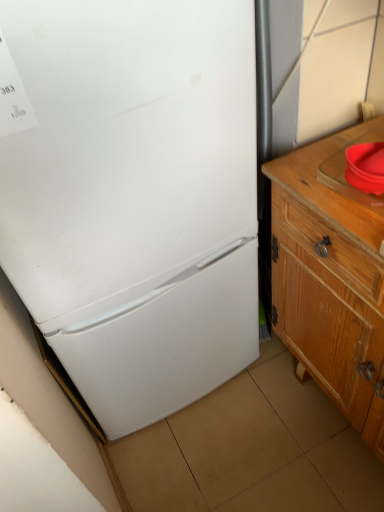
Locate an element on the screen. wooden cabinet at right is located at coordinates (331, 275).

In order to face wooden cabinet at right, should I rotate leftwards or rightwards?

It's best to rotate right around 24.276 degrees.

Locate an element on the screen. red plastic sink at right is located at coordinates (345, 170).

Is wooden cabinet at right aimed at red plastic sink at right?

No, wooden cabinet at right is not facing towards red plastic sink at right.

Is wooden cabinet at right beside red plastic sink at right?

No, wooden cabinet at right is not touching red plastic sink at right.

From the image's perspective, which is below, wooden cabinet at right or red plastic sink at right?

wooden cabinet at right appears lower in the image.

From the image's perspective, is white matte refrigerator at left above red plastic sink at right?

Actually, white matte refrigerator at left appears below red plastic sink at right in the image.

This screenshot has height=512, width=384. In order to click on sink on the right of white matte refrigerator at left in this screenshot , I will do `click(345, 170)`.

Does point (168, 317) come farther from viewer compared to point (383, 139)?

Yes, point (168, 317) is behind point (383, 139).

Is red plastic sink at right aimed at wooden cabinet at right?

No, red plastic sink at right does not turn towards wooden cabinet at right.

Who is smaller, red plastic sink at right or wooden cabinet at right?

With smaller size is red plastic sink at right.

This screenshot has height=512, width=384. Identify the location of sink that appears on the left of wooden cabinet at right. (345, 170).

Who is smaller, wooden cabinet at right or white matte refrigerator at left?

wooden cabinet at right is smaller.

Is wooden cabinet at right oriented towards white matte refrigerator at left?

No, wooden cabinet at right is not oriented towards white matte refrigerator at left.

Is wooden cabinet at right in contact with white matte refrigerator at left?

No, wooden cabinet at right is not making contact with white matte refrigerator at left.

Which object is positioned more to the right, wooden cabinet at right or white matte refrigerator at left?

Positioned to the right is wooden cabinet at right.

Does point (379, 205) appear closer or farther from the camera than point (106, 227)?

Point (379, 205).

Can you confirm if red plastic sink at right is thinner than white matte refrigerator at left?

Indeed, red plastic sink at right has a lesser width compared to white matte refrigerator at left.

Between red plastic sink at right and white matte refrigerator at left, which one has less height?

red plastic sink at right is shorter.

Which is in front, red plastic sink at right or white matte refrigerator at left?

white matte refrigerator at left is in front.

Is white matte refrigerator at left positioned beyond the bounds of wooden cabinet at right?

That's correct, white matte refrigerator at left is outside of wooden cabinet at right.

Who is shorter, white matte refrigerator at left or wooden cabinet at right?

wooden cabinet at right.

Considering the relative sizes of white matte refrigerator at left and wooden cabinet at right in the image provided, is white matte refrigerator at left smaller than wooden cabinet at right?

Actually, white matte refrigerator at left might be larger than wooden cabinet at right.

Can you see white matte refrigerator at left touching wooden cabinet at right?

No, white matte refrigerator at left is not making contact with wooden cabinet at right.

Where is `sink lying on the left of wooden cabinet at right`? This screenshot has width=384, height=512. sink lying on the left of wooden cabinet at right is located at coordinates point(345,170).

The height and width of the screenshot is (512, 384). What are the coordinates of `refrigerator below the red plastic sink at right (from a real-world perspective)` in the screenshot? It's located at (133, 195).

Based on their spatial positions, is wooden cabinet at right or red plastic sink at right further from white matte refrigerator at left?

red plastic sink at right is further to white matte refrigerator at left.

When comparing their distances from wooden cabinet at right, does red plastic sink at right or white matte refrigerator at left seem further?

white matte refrigerator at left is positioned further to the anchor wooden cabinet at right.

Estimate the real-world distances between objects in this image. Which object is closer to red plastic sink at right, white matte refrigerator at left or wooden cabinet at right?

wooden cabinet at right is closer to red plastic sink at right.

Considering their positions, is white matte refrigerator at left positioned closer to wooden cabinet at right than red plastic sink at right?

Among the two, red plastic sink at right is located nearer to wooden cabinet at right.

Looking at the image, which one is located further to white matte refrigerator at left, red plastic sink at right or wooden cabinet at right?

Among the two, red plastic sink at right is located further to white matte refrigerator at left.

Considering their positions, is wooden cabinet at right positioned further to red plastic sink at right than white matte refrigerator at left?

white matte refrigerator at left is further to red plastic sink at right.

This screenshot has height=512, width=384. Identify the location of sink located between white matte refrigerator at left and wooden cabinet at right in the left-right direction. (345, 170).